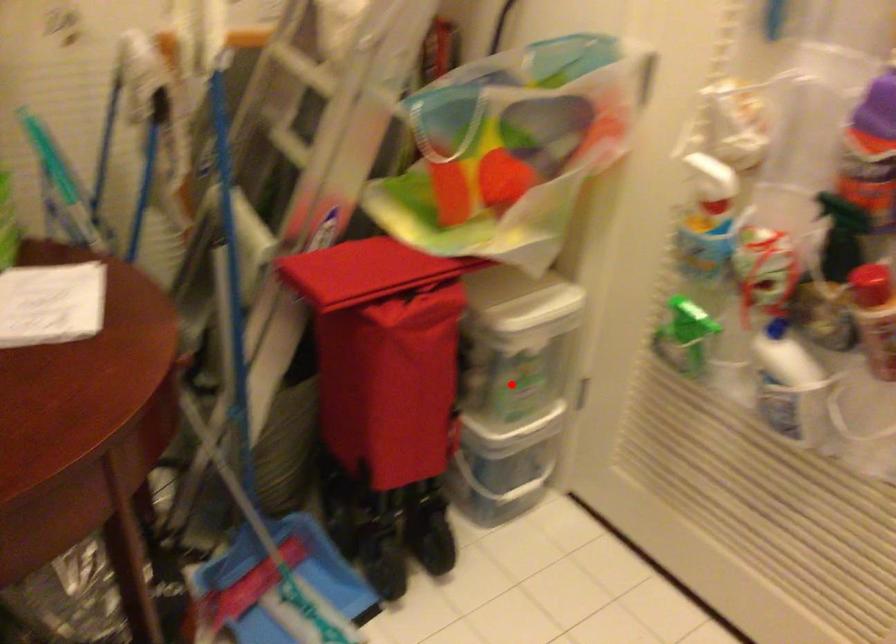
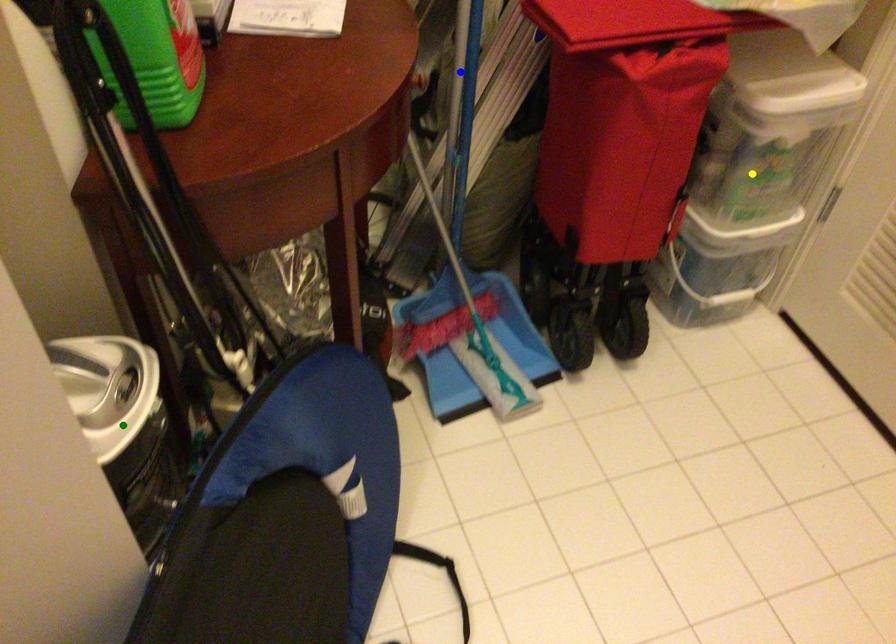
Question: I am providing you with two images of the same scene from different viewpoints. A red point is marked on the first image. You are given multiple points on the second image. Which spot in image 2 lines up with the point in image 1?

Choices:
 (A) yellow point
 (B) green point
 (C) blue point

Answer: (A)